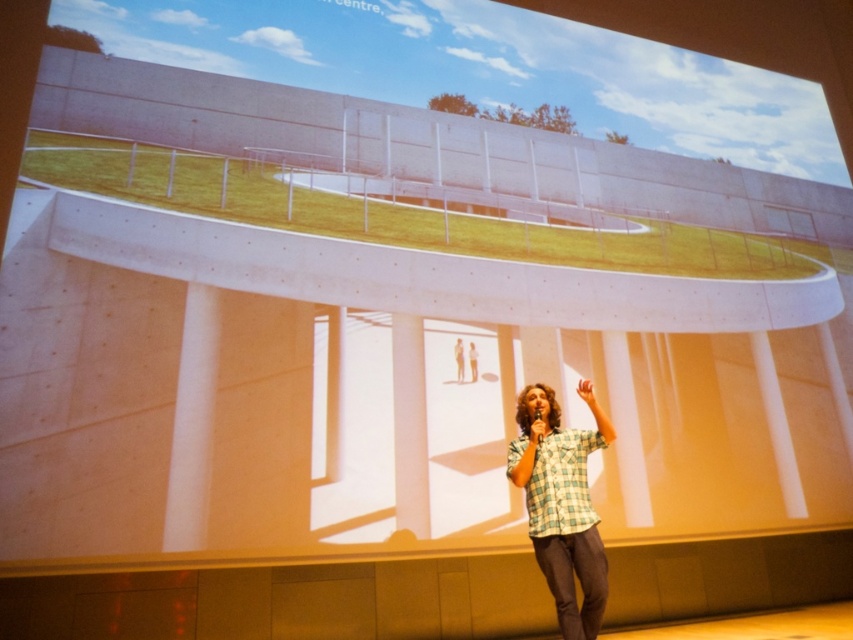
Question: Does green checkered shirt at center have a larger size compared to light brown plaid shirt at center?

Choices:
 (A) yes
 (B) no

Answer: (A)

Question: Which point is farther from the camera taking this photo?

Choices:
 (A) (468, 362)
 (B) (460, 365)

Answer: (A)

Question: Which object is farther from the camera taking this photo?

Choices:
 (A) green checkered shirt at center
 (B) green plaid shirt at center

Answer: (A)

Question: Observing the image, what is the correct spatial positioning of green plaid shirt at center in reference to light brown plaid shirt at center?

Choices:
 (A) right
 (B) left

Answer: (A)

Question: Which of the following is the farthest from the observer?

Choices:
 (A) green plaid shirt at center
 (B) green checkered shirt at center

Answer: (B)

Question: Does green plaid shirt at center have a lesser width compared to green checkered shirt at center?

Choices:
 (A) no
 (B) yes

Answer: (A)